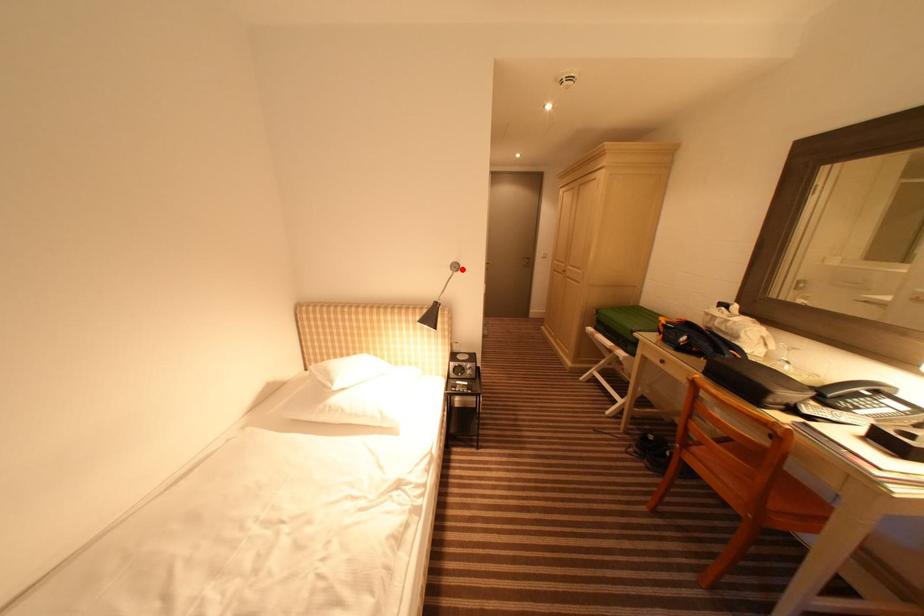
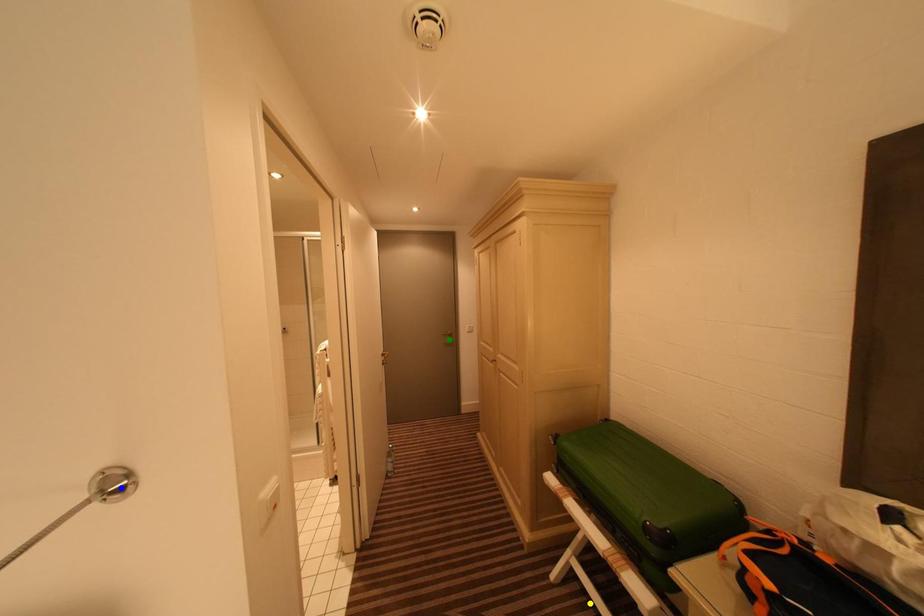
Question: I am providing you with two images of the same scene from different viewpoints. A red point is marked on the first image. You are given multiple points on the second image. Can you choose the point in image 2 that corresponds to the point in image 1?

Choices:
 (A) yellow point
 (B) blue point
 (C) green point

Answer: (B)